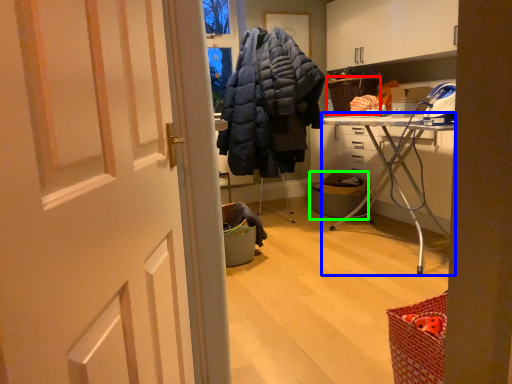
Question: Which object is positioned farthest from picnic basket (highlighted by a red box)? Select from furniture (highlighted by a blue box) and laundry basket (highlighted by a green box).

Choices:
 (A) furniture
 (B) laundry basket

Answer: (A)